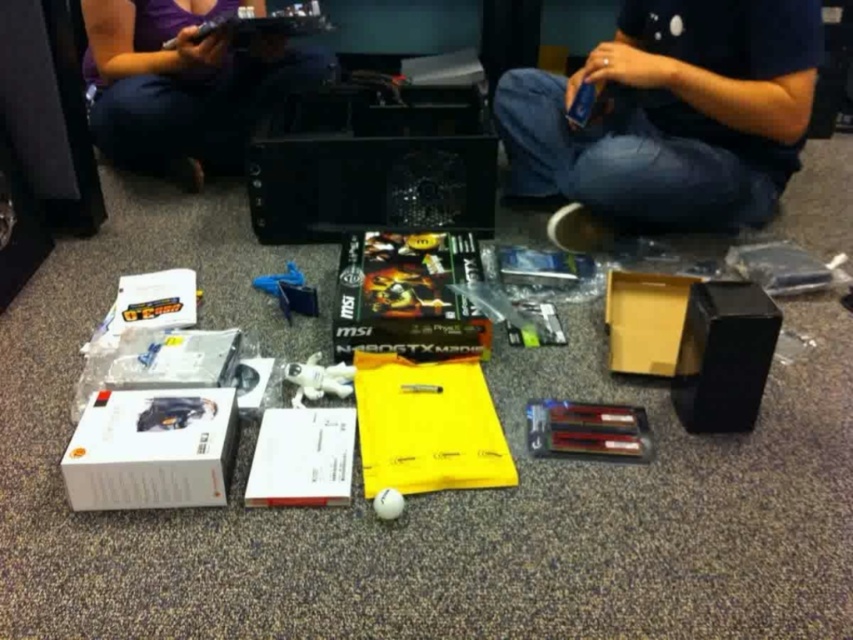
You are organizing the items on the floor. You need to place the blue plastic toy at center and the white rubber ball at center into separate containers. Which object should you pick up first to avoid covering the other?

You should pick up the blue plastic toy at center first because it is positioned over the white rubber ball at center, so removing it first will prevent covering the ball.

You are organizing a small party and need to place decorations. You have a matte purple shirt at upper left and a white rubber ball at center. Which item should you choose if you want something larger to cover more space?

The matte purple shirt at upper left is larger in size than the white rubber ball at center, so you should choose the matte purple shirt at upper left to cover more space.

You are organizing a toy store and see the matte purple shirt at upper left and the white rubber ball at center. Which toy is positioned to the right side of the other?

The white rubber ball at center is to the right of the matte purple shirt at upper left.